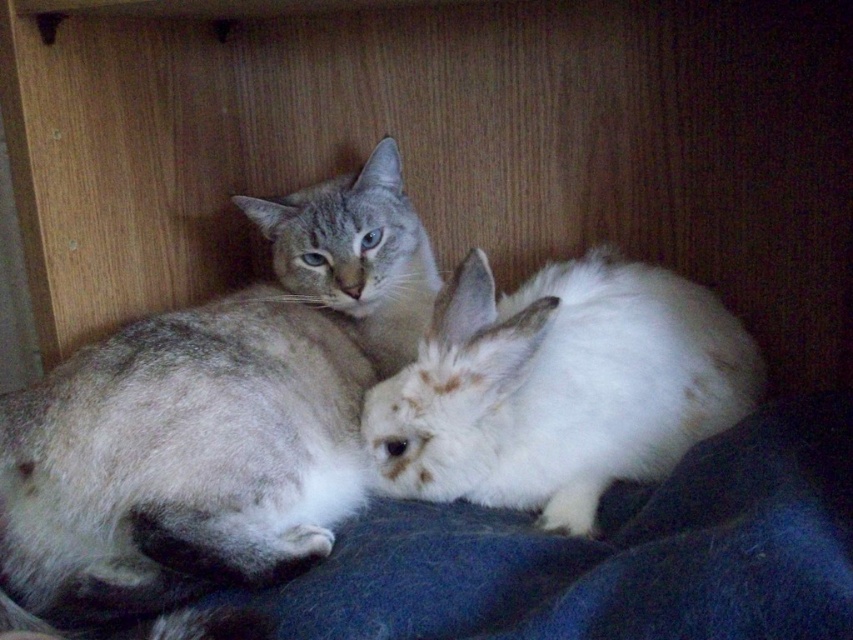
Question: Which point is closer to the camera?

Choices:
 (A) (538, 275)
 (B) (409, 324)

Answer: (A)

Question: Can you confirm if gray fur cat at upper left is positioned to the right of white fluffy rabbit at center?

Choices:
 (A) yes
 (B) no

Answer: (B)

Question: Which object is closer to the camera taking this photo?

Choices:
 (A) gray fur cat at upper left
 (B) white fluffy rabbit at center

Answer: (A)

Question: Is gray fur cat at upper left bigger than white fluffy rabbit at center?

Choices:
 (A) yes
 (B) no

Answer: (A)

Question: Where is gray fur cat at upper left located in relation to white fluffy rabbit at center in the image?

Choices:
 (A) right
 (B) left

Answer: (B)